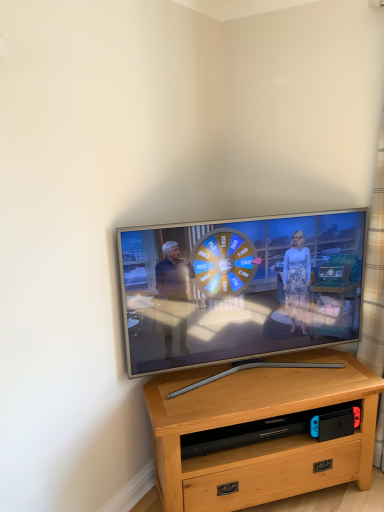
Question: Does plaid fabric curtain at right have a larger size compared to light brown wood desk at center?

Choices:
 (A) no
 (B) yes

Answer: (A)

Question: Are plaid fabric curtain at right and light brown wood desk at center located far from each other?

Choices:
 (A) yes
 (B) no

Answer: (B)

Question: Is plaid fabric curtain at right shorter than light brown wood desk at center?

Choices:
 (A) no
 (B) yes

Answer: (A)

Question: From a real-world perspective, is plaid fabric curtain at right on top of light brown wood desk at center?

Choices:
 (A) yes
 (B) no

Answer: (A)

Question: Considering the relative sizes of plaid fabric curtain at right and light brown wood desk at center in the image provided, is plaid fabric curtain at right wider than light brown wood desk at center?

Choices:
 (A) yes
 (B) no

Answer: (B)

Question: Is point (370, 387) closer or farther from the camera than point (140, 276)?

Choices:
 (A) farther
 (B) closer

Answer: (A)

Question: Considering the positions of light brown wood desk at center and silver metallic tv at center in the image, is light brown wood desk at center bigger or smaller than silver metallic tv at center?

Choices:
 (A) small
 (B) big

Answer: (B)

Question: Do you think light brown wood desk at center is within silver metallic tv at center, or outside of it?

Choices:
 (A) outside
 (B) inside

Answer: (A)

Question: Relative to silver metallic tv at center, is light brown wood desk at center in front or behind?

Choices:
 (A) behind
 (B) front

Answer: (A)

Question: Does point (375, 331) appear closer or farther from the camera than point (304, 271)?

Choices:
 (A) farther
 (B) closer

Answer: (A)

Question: Do you think plaid fabric curtain at right is within silver metallic tv at center, or outside of it?

Choices:
 (A) outside
 (B) inside

Answer: (A)

Question: Is plaid fabric curtain at right wider or thinner than silver metallic tv at center?

Choices:
 (A) thin
 (B) wide

Answer: (A)

Question: From a real-world perspective, is plaid fabric curtain at right above or below silver metallic tv at center?

Choices:
 (A) below
 (B) above

Answer: (B)

Question: In terms of width, does silver metallic tv at center look wider or thinner when compared to light brown wood desk at center?

Choices:
 (A) wide
 (B) thin

Answer: (B)

Question: From the image's perspective, is silver metallic tv at center located above or below light brown wood desk at center?

Choices:
 (A) below
 (B) above

Answer: (B)